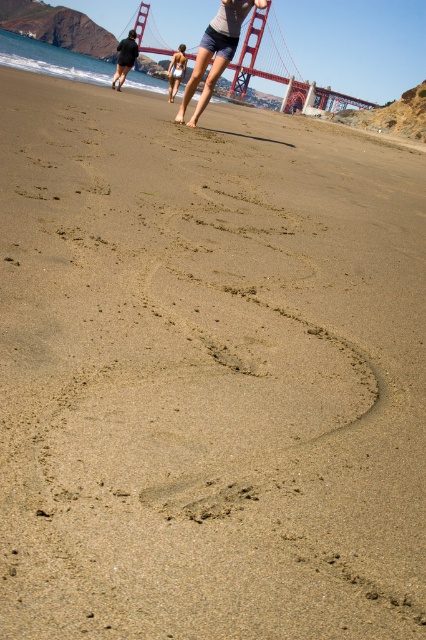
Question: Can you confirm if red painted steel golden gate bridge at upper center is bigger than white bikini at center?

Choices:
 (A) yes
 (B) no

Answer: (A)

Question: Which point is closer to the camera?

Choices:
 (A) white bikini at center
 (B) matte gray shorts at center

Answer: (B)

Question: Which point appears farthest from the camera in this image?

Choices:
 (A) (264, 24)
 (B) (170, 92)
 (C) (124, 61)
 (D) (215, 60)

Answer: (A)

Question: Considering the relative positions of matte gray shorts at center and white bikini at center in the image provided, where is matte gray shorts at center located with respect to white bikini at center?

Choices:
 (A) right
 (B) left

Answer: (A)

Question: Does dark blue hoodie at left have a greater width compared to white bikini at center?

Choices:
 (A) yes
 (B) no

Answer: (A)

Question: Which point appears closest to the camera in this image?

Choices:
 (A) (215, 77)
 (B) (129, 61)

Answer: (A)